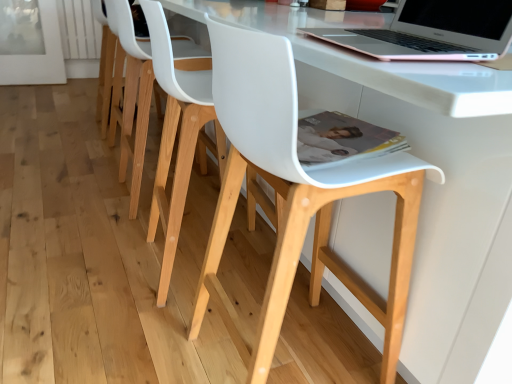
Question: Is white matte chair at center, which is counted as the first chair, starting from the front, facing away from rose gold aluminum laptop at upper right?

Choices:
 (A) yes
 (B) no

Answer: (B)

Question: Can you confirm if white matte chair at center, acting as the third chair starting from the back, is positioned to the right of rose gold aluminum laptop at upper right?

Choices:
 (A) yes
 (B) no

Answer: (B)

Question: Does white matte chair at center, which is counted as the first chair, starting from the front, have a larger size compared to rose gold aluminum laptop at upper right?

Choices:
 (A) yes
 (B) no

Answer: (A)

Question: From the image's perspective, is white matte chair at center, which is counted as the first chair, starting from the front, located above rose gold aluminum laptop at upper right?

Choices:
 (A) no
 (B) yes

Answer: (A)

Question: From the image's perspective, would you say white matte chair at center, acting as the third chair starting from the back, is shown under rose gold aluminum laptop at upper right?

Choices:
 (A) no
 (B) yes

Answer: (B)

Question: Based on their sizes in the image, would you say rose gold aluminum laptop at upper right is bigger or smaller than white matte chair at center, which ranks as the third chair in front-to-back order?

Choices:
 (A) small
 (B) big

Answer: (A)

Question: From a real-world perspective, is rose gold aluminum laptop at upper right positioned above or below white matte chair at center, which ranks as the third chair in front-to-back order?

Choices:
 (A) above
 (B) below

Answer: (A)

Question: In the image, is rose gold aluminum laptop at upper right positioned in front of or behind white matte chair at center, the first chair from the back?

Choices:
 (A) behind
 (B) front

Answer: (B)

Question: Considering the positions of rose gold aluminum laptop at upper right and white matte chair at center, the first chair from the back, in the image, is rose gold aluminum laptop at upper right wider or thinner than white matte chair at center, the first chair from the back,?

Choices:
 (A) wide
 (B) thin

Answer: (B)

Question: Visually, is white matte chair at center, the first chair from the back, positioned to the left or to the right of white matte chair at center, which is counted as the first chair, starting from the front?

Choices:
 (A) left
 (B) right

Answer: (A)

Question: Is white matte chair at center, which ranks as the third chair in front-to-back order, taller or shorter than white matte chair at center, acting as the third chair starting from the back?

Choices:
 (A) short
 (B) tall

Answer: (A)

Question: Is white matte chair at center, which ranks as the third chair in front-to-back order, situated inside white matte chair at center, acting as the third chair starting from the back, or outside?

Choices:
 (A) inside
 (B) outside

Answer: (B)

Question: Is white matte chair at center, the first chair from the back, in front of or behind white matte chair at center, acting as the third chair starting from the back, in the image?

Choices:
 (A) behind
 (B) front

Answer: (A)

Question: Based on their sizes in the image, would you say white matte plastic chair at center, which appears as the second chair when viewed from the front, is bigger or smaller than white matte chair at center, acting as the third chair starting from the back?

Choices:
 (A) small
 (B) big

Answer: (A)

Question: In terms of width, does white matte plastic chair at center, positioned as the second chair in back-to-front order, look wider or thinner when compared to white matte chair at center, acting as the third chair starting from the back?

Choices:
 (A) wide
 (B) thin

Answer: (B)